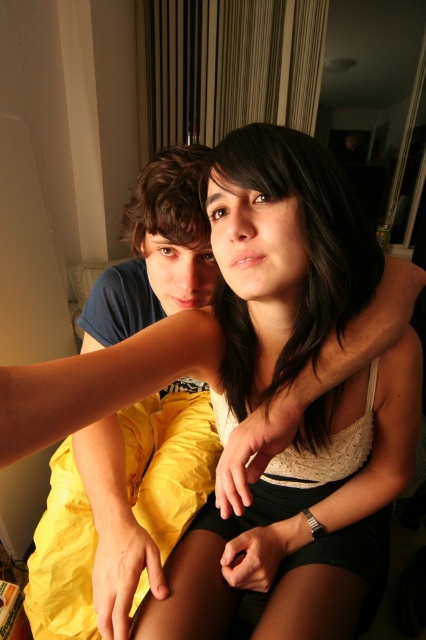
You are designing a new clothing line and want to ensure that the matte blue shirt at left will fit over the smooth dark hair at center without any issues. Based on the image, can you confirm if the shirt is wider than the hair?

The matte blue shirt at left is wider than the smooth dark hair at center, so the shirt should fit over the hair without any issues.

You are designing a photo frame for this image. The frame has a width of 10 cm. The matte blue shirt at left and the smooth dark hair at center need to be centered in the frame. Given their sizes, which object should be placed in the center of the frame to ensure symmetry?

The matte blue shirt at left is bigger than smooth dark hair at center, so to ensure symmetry, the matte blue shirt at left should be placed in the center of the frame.

Based on the scene description, which object is taller between the matte blue shirt at left and the smooth dark hair at center?

The matte blue shirt at left is taller than the smooth dark hair at center.